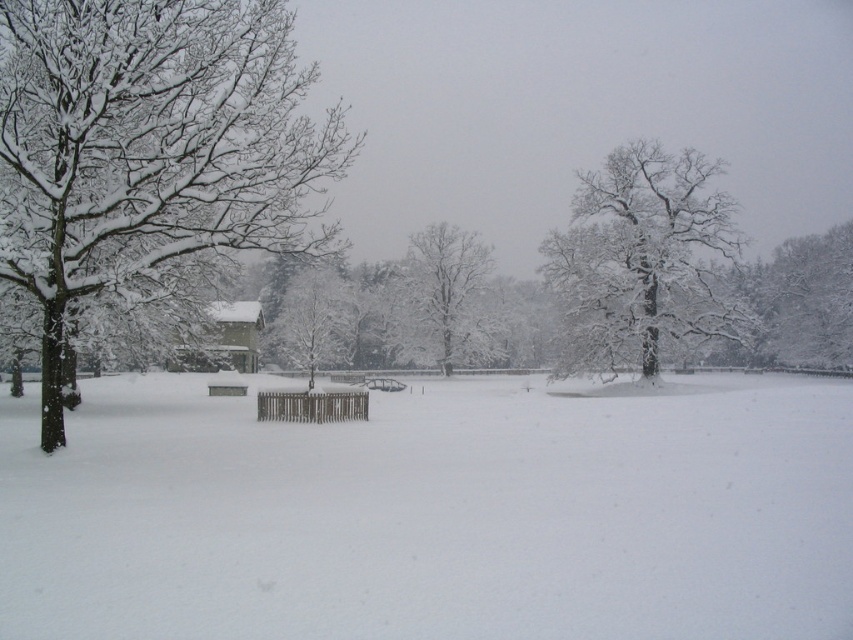
Question: Which object is the farthest from the snow-covered tree at center?

Choices:
 (A) snow-covered branches at center
 (B) white fluffy snow at center

Answer: (B)

Question: Which point appears closest to the camera in this image?

Choices:
 (A) (614, 528)
 (B) (576, 232)
 (C) (850, 308)

Answer: (A)

Question: Is white fluffy snow at center bigger than snow-covered tree at upper right?

Choices:
 (A) yes
 (B) no

Answer: (B)

Question: Can you confirm if white fluffy snow at center is positioned to the left of snow-covered branches at center?

Choices:
 (A) no
 (B) yes

Answer: (B)

Question: Which is nearer to the snow-covered tree at center?

Choices:
 (A) snow-covered tree at upper right
 (B) snow-covered branches at center
 (C) white fluffy snow at center
 (D) snow-covered tree at left

Answer: (B)

Question: Is snow-covered branches at center bigger than snow-covered tree at upper right?

Choices:
 (A) yes
 (B) no

Answer: (A)